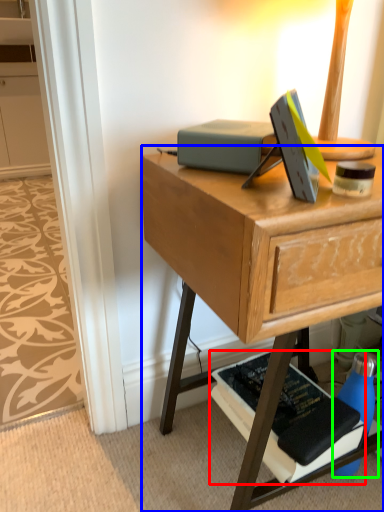
Question: Which object is positioned farthest from paperback book (highlighted by a red box)? Select from desk (highlighted by a blue box) and bottle (highlighted by a green box).

Choices:
 (A) desk
 (B) bottle

Answer: (A)